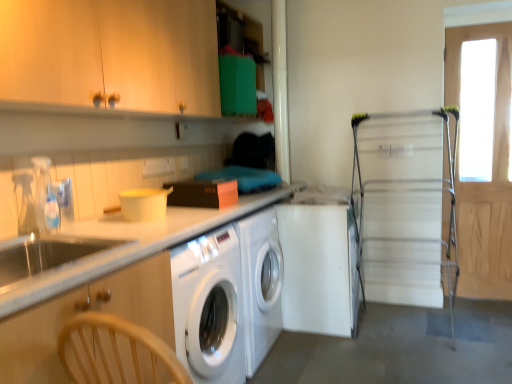
Question: Does clear plastic faucet at left have a greater height compared to wooden cabinet at left, which appears as the 1th cabinetry when ordered from the bottom?

Choices:
 (A) yes
 (B) no

Answer: (B)

Question: Can you confirm if clear plastic faucet at left is wider than wooden cabinet at left, marked as the second cabinetry in a top-to-bottom arrangement?

Choices:
 (A) no
 (B) yes

Answer: (A)

Question: Is clear plastic faucet at left shorter than wooden cabinet at left, which appears as the 1th cabinetry when ordered from the bottom?

Choices:
 (A) yes
 (B) no

Answer: (A)

Question: From a real-world perspective, is clear plastic faucet at left on wooden cabinet at left, marked as the second cabinetry in a top-to-bottom arrangement?

Choices:
 (A) yes
 (B) no

Answer: (A)

Question: Can you confirm if clear plastic faucet at left is positioned to the right of wooden cabinet at left, which appears as the 1th cabinetry when ordered from the bottom?

Choices:
 (A) no
 (B) yes

Answer: (A)

Question: Is point (96, 228) positioned closer to the camera than point (146, 69)?

Choices:
 (A) closer
 (B) farther

Answer: (A)

Question: In terms of width, does white glossy countertop at left look wider or thinner when compared to wooden cabinet at upper left, acting as the second cabinetry starting from the bottom?

Choices:
 (A) thin
 (B) wide

Answer: (B)

Question: Is white glossy countertop at left to the left or to the right of wooden cabinet at upper left, acting as the second cabinetry starting from the bottom, in the image?

Choices:
 (A) left
 (B) right

Answer: (B)

Question: Looking at the image, does white glossy countertop at left seem bigger or smaller compared to wooden cabinet at upper left, acting as the second cabinetry starting from the bottom?

Choices:
 (A) big
 (B) small

Answer: (B)

Question: Considering their positions, is clear plastic faucet at left located in front of or behind wooden cabinet at left, which appears as the 1th cabinetry when ordered from the bottom?

Choices:
 (A) behind
 (B) front

Answer: (A)

Question: Does point (36, 210) appear closer or farther from the camera than point (57, 377)?

Choices:
 (A) closer
 (B) farther

Answer: (B)

Question: Would you say clear plastic faucet at left is inside or outside wooden cabinet at left, which appears as the 1th cabinetry when ordered from the bottom?

Choices:
 (A) inside
 (B) outside

Answer: (B)

Question: Is clear plastic faucet at left bigger or smaller than wooden cabinet at left, marked as the second cabinetry in a top-to-bottom arrangement?

Choices:
 (A) small
 (B) big

Answer: (A)

Question: Is point (308, 256) positioned closer to the camera than point (439, 258)?

Choices:
 (A) farther
 (B) closer

Answer: (B)

Question: Is white matte washing machine at center taller or shorter than metallic silver drying rack at right, which appears as the second screen door when viewed from the right?

Choices:
 (A) tall
 (B) short

Answer: (B)